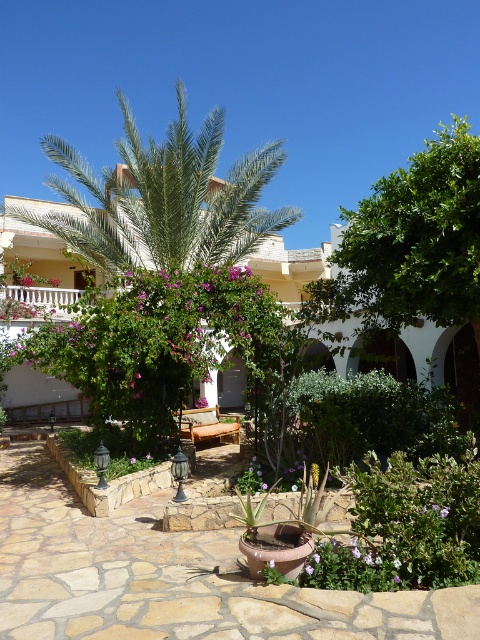
You are planning to install a new lighting fixture in the courtyard. The lighting fixture requires a pole that is 1.5 meters tall. Given the green leafy palm tree at center and the white stucco villa at center, which object can accommodate the pole without it being taller than the object?

The green leafy palm tree at center is smaller than the white stucco villa at center. Since the pole is 1.5 meters tall, it can be placed near the white stucco villa at center because the villa is taller than the palm tree.

You are planning to place a new bench in the courtyard. The bench is 1.5 meters long. You want to place it between the terracotta pot at center and the white stucco villa at center. Is there enough space between them to fit the bench?

The terracotta pot at center is smaller than the white stucco villa at center, but the distance between them isn not specified in the objects description. Therefore, it is unclear if the bench will fit.

You are a gardener who needs to water the terracotta pot at center and the white stucco villa at center. The water source is located at the edge of the courtyard. Which object is closer to the water source?

The terracotta pot at center is closer to the water source because it is only 45.14 feet away from the white stucco villa at center, but the distance from the water source to each object isn